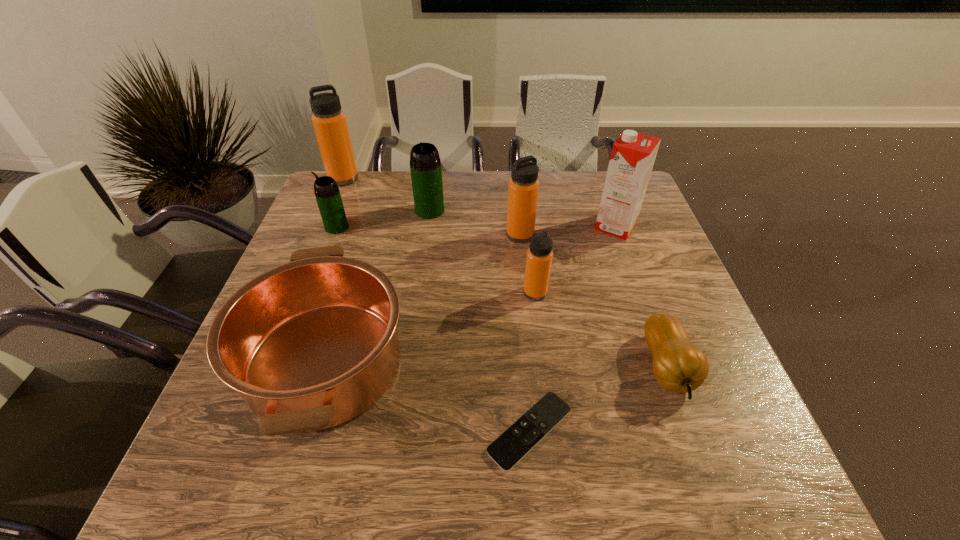
The height and width of the screenshot is (540, 960). In order to click on free spot between the nearest thermos bottle and the saucepan in this screenshot , I will do tap(430, 327).

The height and width of the screenshot is (540, 960). In order to click on vacant space that is in between the nearer green thermos bottle and the farther green thermos bottle in this screenshot , I will do `click(383, 219)`.

I want to click on vacant space that is in between the gourd and the biggest orange thermos bottle, so click(505, 273).

Locate an element on the screen. free space between the carton and the biggest orange thermos bottle is located at coordinates (479, 202).

At what (x,y) coordinates should I click in order to perform the action: click on object that stands as the fourth closest to the seventh tallest object. Please return your answer as a coordinate pair (x, y). Looking at the image, I should click on (425, 165).

Locate which object is the closest to the farthest orange thermos bottle. Please provide its 2D coordinates. Your answer should be formatted as a tuple, i.e. [(x, y)], where the tuple contains the x and y coordinates of a point satisfying the conditions above.

[(328, 197)]

Identify which thermos bottle is the closest to the third shortest object. Please provide its 2D coordinates. Your answer should be formatted as a tuple, i.e. [(x, y)], where the tuple contains the x and y coordinates of a point satisfying the conditions above.

[(328, 197)]

I want to click on thermos bottle that is the second closest to the saucepan, so 539,257.

Point out which orange thermos bottle is positioned as the nearest to the third thermos bottle from left to right. Please provide its 2D coordinates. Your answer should be formatted as a tuple, i.e. [(x, y)], where the tuple contains the x and y coordinates of a point satisfying the conditions above.

[(523, 188)]

The width and height of the screenshot is (960, 540). In order to click on the second closest orange thermos bottle relative to the third shortest object in this screenshot , I will do `click(523, 188)`.